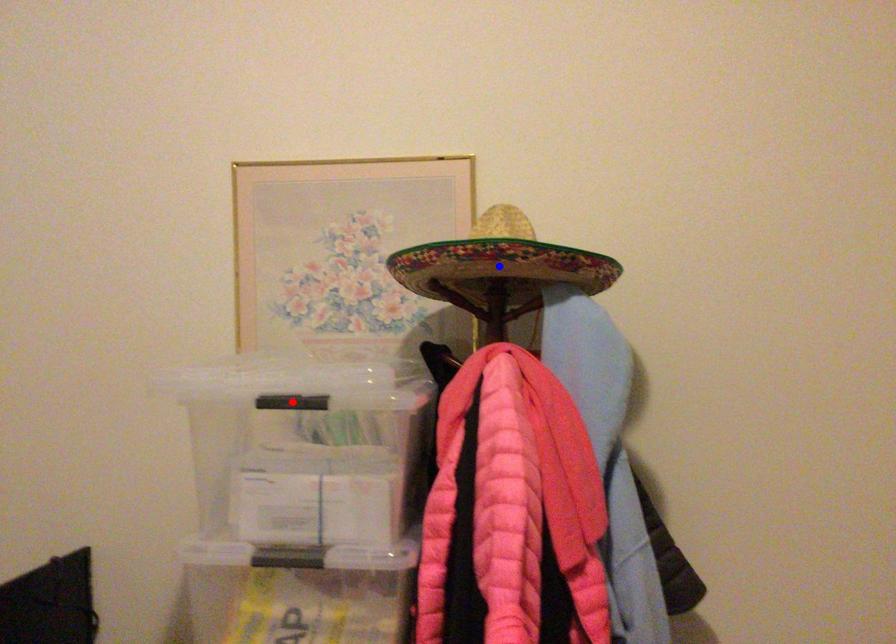
Question: Which of the two points in the image is closer to the camera?

Choices:
 (A) Blue point is closer.
 (B) Red point is closer.

Answer: (B)